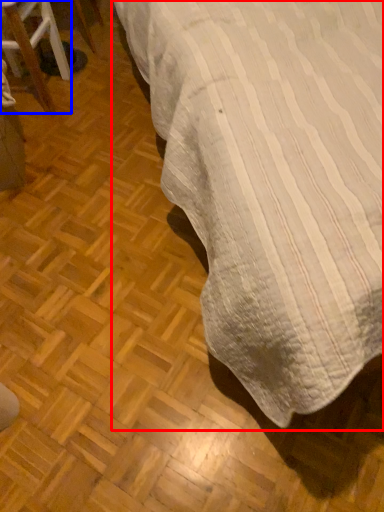
Question: Which object appears closest to the camera in this image, table (highlighted by a red box) or furniture (highlighted by a blue box)?

Choices:
 (A) table
 (B) furniture

Answer: (A)